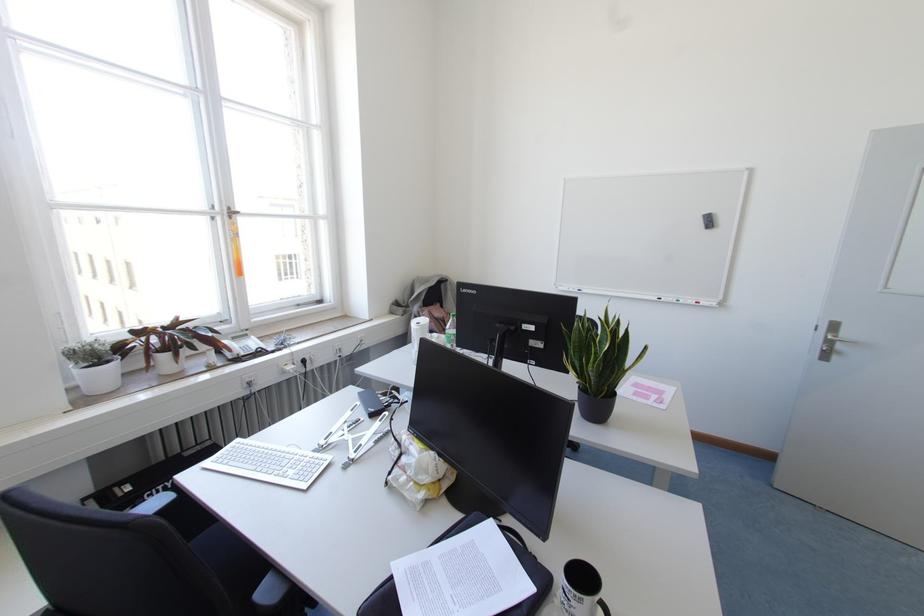
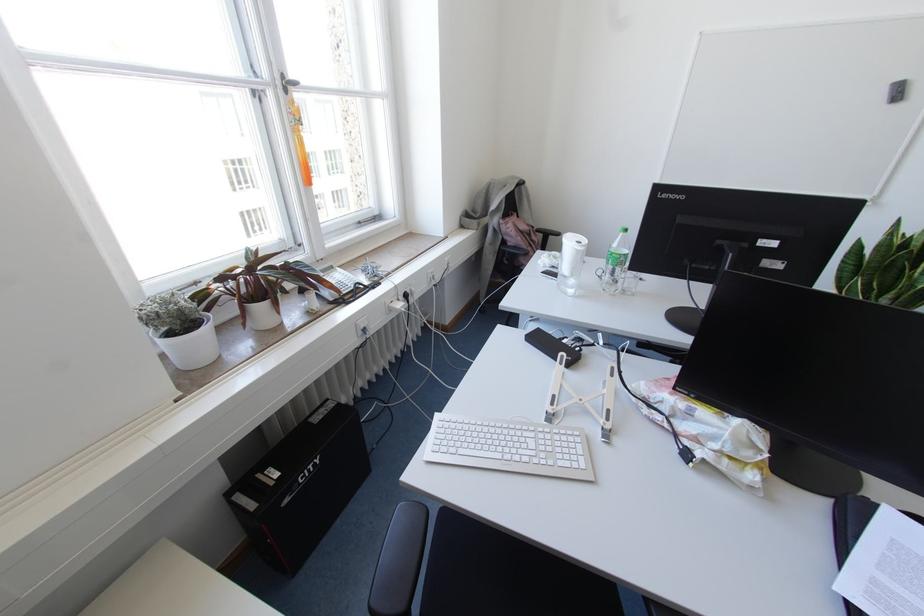
In the second image, find the point that corresponds to point (176, 355) in the first image.

(274, 302)